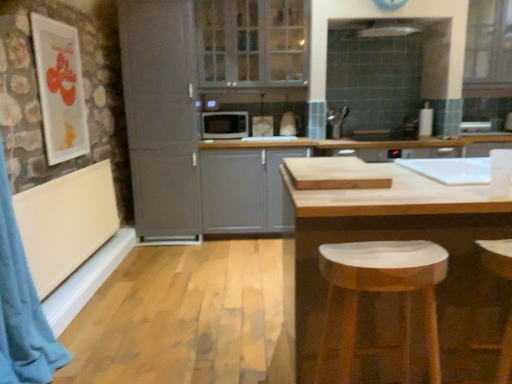
Question: Would you say clear glass cabinet at upper center, which ranks as the 1th window in left-to-right order, is outside matte gray microwave at center?

Choices:
 (A) yes
 (B) no

Answer: (A)

Question: Does clear glass cabinet at upper center, the 2th window positioned from the right, have a greater height compared to matte gray microwave at center?

Choices:
 (A) yes
 (B) no

Answer: (A)

Question: Is clear glass cabinet at upper center, the 2th window positioned from the right, bigger than matte gray microwave at center?

Choices:
 (A) no
 (B) yes

Answer: (B)

Question: Is clear glass cabinet at upper center, the 2th window positioned from the right, positioned with its back to matte gray microwave at center?

Choices:
 (A) no
 (B) yes

Answer: (A)

Question: Is clear glass cabinet at upper center, the 2th window positioned from the right, at the right side of matte gray microwave at center?

Choices:
 (A) yes
 (B) no

Answer: (A)

Question: Is matte gray microwave at center completely or partially inside clear glass cabinet at upper center, the 2th window positioned from the right?

Choices:
 (A) no
 (B) yes

Answer: (A)

Question: Does clear glass window at upper right, which is the 2th window from left to right, have a larger size compared to matte white picture frame at upper left?

Choices:
 (A) no
 (B) yes

Answer: (B)

Question: Is clear glass window at upper right, marked as the first window in a right-to-left arrangement, shorter than matte white picture frame at upper left?

Choices:
 (A) yes
 (B) no

Answer: (A)

Question: Would you consider clear glass window at upper right, marked as the first window in a right-to-left arrangement, to be distant from matte white picture frame at upper left?

Choices:
 (A) no
 (B) yes

Answer: (B)

Question: Considering the relative sizes of clear glass window at upper right, marked as the first window in a right-to-left arrangement, and matte white picture frame at upper left in the image provided, is clear glass window at upper right, marked as the first window in a right-to-left arrangement, smaller than matte white picture frame at upper left?

Choices:
 (A) yes
 (B) no

Answer: (B)

Question: From the image's perspective, is clear glass window at upper right, which is the 2th window from left to right, beneath matte white picture frame at upper left?

Choices:
 (A) no
 (B) yes

Answer: (A)

Question: Would you say clear glass window at upper right, which is the 2th window from left to right, contains matte white picture frame at upper left?

Choices:
 (A) yes
 (B) no

Answer: (B)

Question: Considering the relative sizes of matte white picture frame at upper left and matte gray cabinet at left, which ranks as the 2th cabinetry in right-to-left order, in the image provided, is matte white picture frame at upper left thinner than matte gray cabinet at left, which ranks as the 2th cabinetry in right-to-left order,?

Choices:
 (A) yes
 (B) no

Answer: (A)